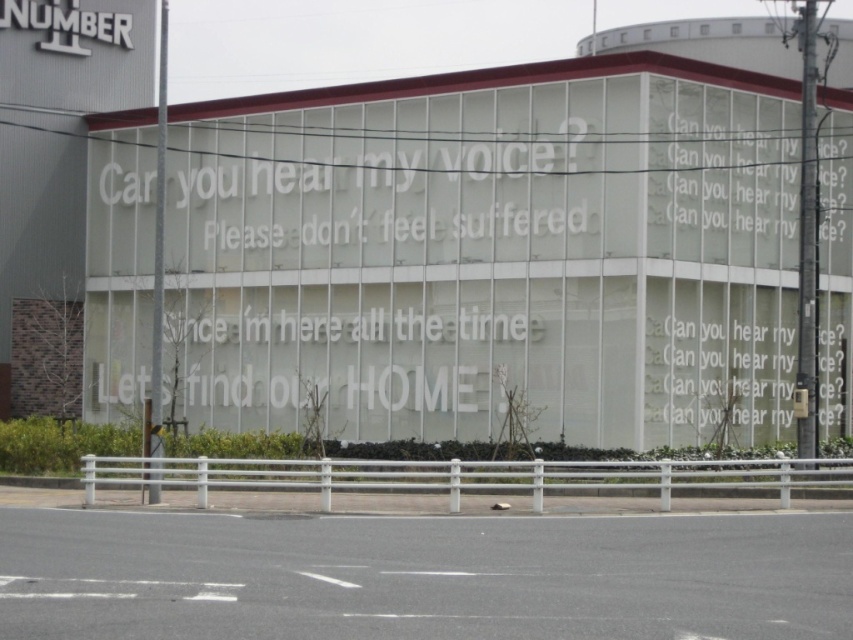
Looking at the building with the glass facade, where is the white metallic sign at upper left in relation to the white paper text at upper right?

The white metallic sign at upper left is positioned to the left of the white paper text at upper right.

You are standing in front of the building and notice a point marked at coordinates (67, 24). What object is located at this point?

The point at (67, 24) marks the location of the white metallic sign at upper left.

You are standing in front of the building and want to read both the white metallic sign at upper left and the white paper text at upper right. Which one is closer to you?

The white metallic sign at upper left is closer to you because the white paper text at upper right is behind it.